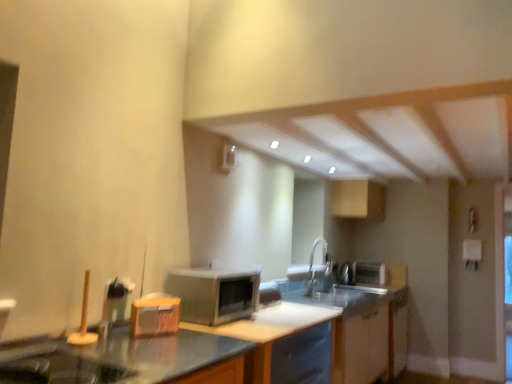
Question: From their relative heights in the image, would you say satin silver microwave at center is taller or shorter than satin silver toaster at upper right, acting as the 1th appliance starting from the back?

Choices:
 (A) tall
 (B) short

Answer: (A)

Question: Considering their positions, is satin silver microwave at center located in front of or behind satin silver toaster at upper right, the 1th appliance from the bottom?

Choices:
 (A) behind
 (B) front

Answer: (B)

Question: Which of these objects is positioned closest to the silver metallic faucet at center?

Choices:
 (A) satin silver microwave at center
 (B) wooden cutting board at left, the 1th appliance when ordered from top to bottom
 (C) matte wood cabinet at center, placed as the first cabinetry when sorted from back to front
 (D) satin silver toaster at upper right, the 1th appliance from the bottom
 (E) white glossy counter top at center

Answer: (C)

Question: Considering the real-world distances, which object is farthest from the matte wood cabinet at center, acting as the 2th cabinetry starting from the bottom?

Choices:
 (A) white glossy cabinet at lower center, the second cabinetry from the back
 (B) silver metallic faucet at center
 (C) white glossy counter top at center
 (D) wooden cutting board at left, which ranks as the first appliance in front-to-back order
 (E) satin silver microwave at center

Answer: (D)